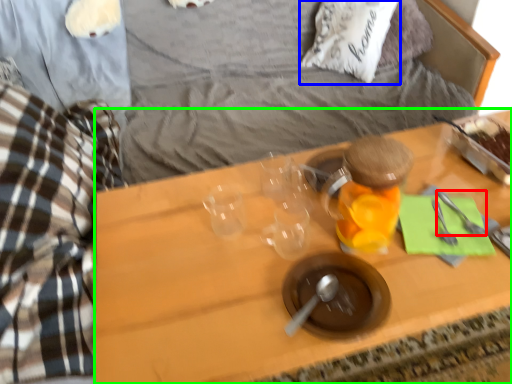
Question: Which object is positioned closest to silverware (highlighted by a red box)? Select from pillow (highlighted by a blue box) and desk (highlighted by a green box).

Choices:
 (A) pillow
 (B) desk

Answer: (B)